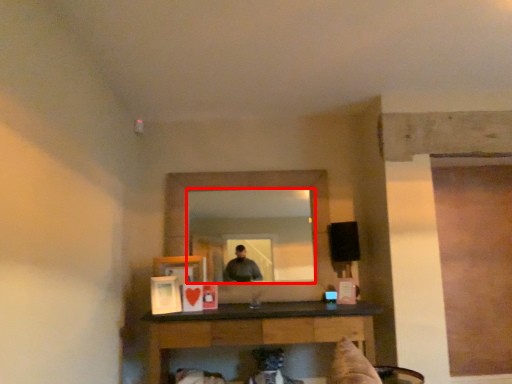
Question: From the image's perspective, where is mirror (annotated by the red box) located in relation to table in the image?

Choices:
 (A) below
 (B) above

Answer: (B)